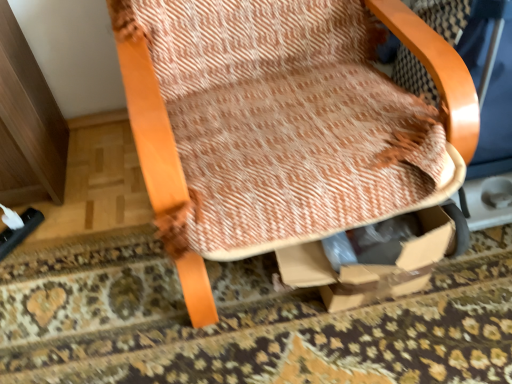
The image size is (512, 384). I want to click on free space above textured beige rug at center (from a real-world perspective), so [x=273, y=313].